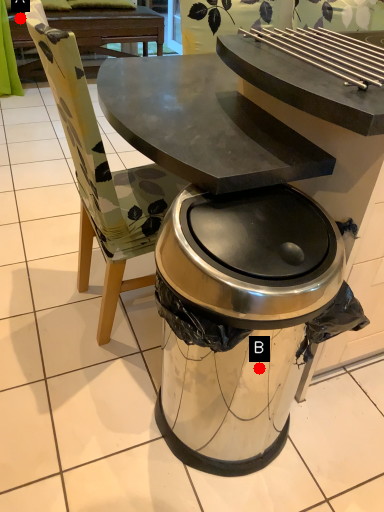
Question: Two points are circled on the image, labeled by A and B beside each circle. Which of the following is the farthest from the observer?

Choices:
 (A) A is further
 (B) B is further

Answer: (A)